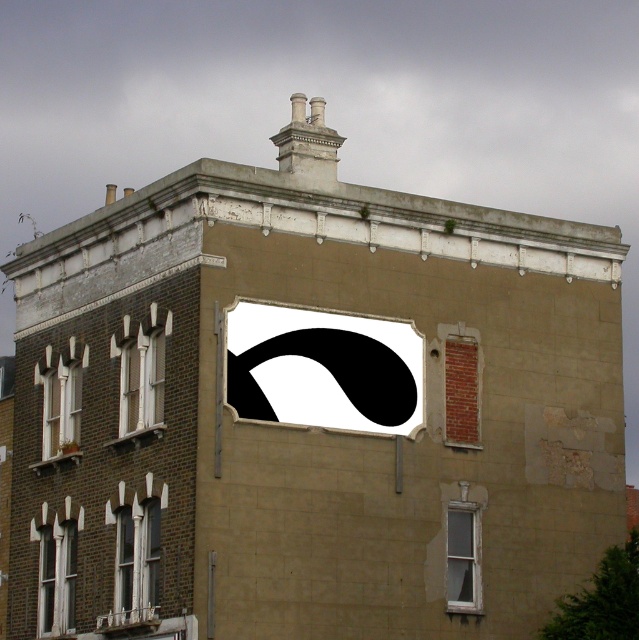
Question: Which of the following is the closest to the observer?

Choices:
 (A) white wooden window at lower left
 (B) white painted wood window at left
 (C) clear glass window at lower right

Answer: (A)

Question: Is black matte hole at center above clear glass window at lower right?

Choices:
 (A) yes
 (B) no

Answer: (A)

Question: Is white wooden window at lower left smaller than white painted wood at left?

Choices:
 (A) yes
 (B) no

Answer: (B)

Question: Does white painted wood at left appear on the right side of clear glass window at lower right?

Choices:
 (A) no
 (B) yes

Answer: (A)

Question: Which point is farther from the camera taking this photo?

Choices:
 (A) (450, 595)
 (B) (116, 580)
 (C) (134, 426)

Answer: (C)

Question: Which object appears farthest from the camera in this image?

Choices:
 (A) matte white window at lower left
 (B) white painted wood at left
 (C) black matte hole at center
 (D) clear glass window at lower right

Answer: (A)